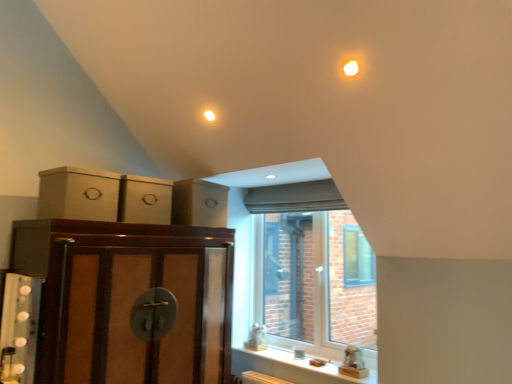
Question: From a real-world perspective, is brown wood cabinet at left, marked as the 1th cabinetry in a bottom-to-top arrangement, positioned above or below matte cardboard drawer at upper left?

Choices:
 (A) above
 (B) below

Answer: (B)

Question: In the image, is brown wood cabinet at left, positioned as the third cabinetry in top-to-bottom order, on the left side or the right side of matte cardboard drawer at upper left?

Choices:
 (A) right
 (B) left

Answer: (B)

Question: Which object is positioned closest to the brown wood cabinet at left, positioned as the third cabinetry in top-to-bottom order?

Choices:
 (A) brown cardboard boxes at upper left, which ranks as the second cabinetry in top-to-bottom order
 (B) matte cardboard box at upper left, placed as the third cabinetry when sorted from bottom to top
 (C) clear glass window at center
 (D) matte cardboard drawer at upper left

Answer: (B)

Question: Based on their relative distances, which object is nearer to the clear glass window at center?

Choices:
 (A) brown cardboard boxes at upper left, which ranks as the second cabinetry in top-to-bottom order
 (B) brown wood cabinet at left, positioned as the third cabinetry in top-to-bottom order
 (C) matte cardboard drawer at upper left
 (D) matte cardboard box at upper left, placed as the third cabinetry when sorted from bottom to top

Answer: (C)